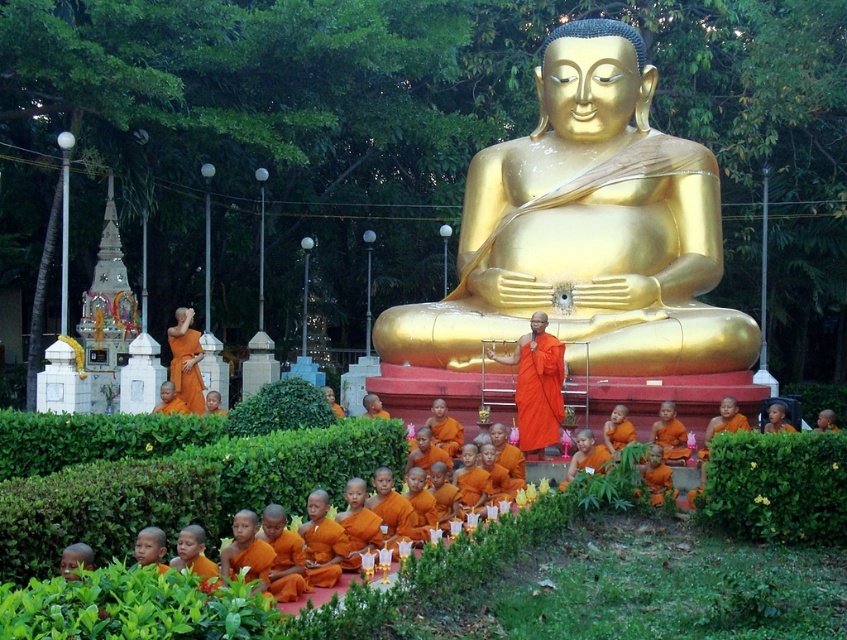
You are a visitor at the temple and want to take a photo of the gold polished statue at center without including the green leafy hedge at lower right in the frame. Based on their sizes, is it possible to do so?

The gold polished statue at center has a larger size compared to green leafy hedge at lower right, so it is possible to take a photo of the gold polished statue at center without including the green leafy hedge at lower right in the frame by focusing on the statue and adjusting the camera angle to exclude the smaller hedge.

You are a visitor at the temple and want to take a photo of the gold polished statue at center and the green leafy hedge at center. Which object should you focus on first if you want to capture both in the same frame without moving the camera?

The gold polished statue at center is positioned on the right side of green leafy hedge at center, so you should focus on the green leafy hedge at center first as it is on the left side and the statue is on the right to include both in the frame without moving the camera.